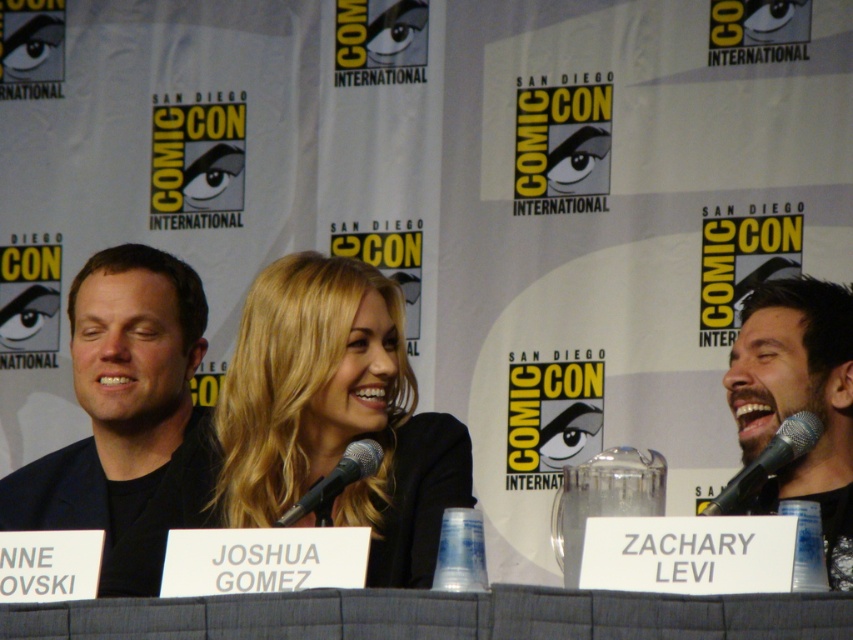
Can you confirm if black matte suit at left is positioned to the left of black metallic microphone at center?

Yes, black matte suit at left is to the left of black metallic microphone at center.

Between point (79, 508) and point (347, 445), which one is positioned in front?

Point (347, 445)

Describe the element at coordinates (128, 419) in the screenshot. I see `black matte suit at left` at that location.

Identify the location of black matte suit at left. This screenshot has width=853, height=640. (128, 419).

Based on the photo, can you confirm if blonde hair at center is shorter than black matte suit at left?

Indeed, blonde hair at center has a lesser height compared to black matte suit at left.

Between blonde hair at center and black matte suit at left, which one is positioned higher?

Positioned higher is blonde hair at center.

You are a GUI agent. You are given a task and a screenshot of the screen. Output one action in this format:
    pyautogui.click(x=<x>, y=<y>)
    Task: Click on the blonde hair at center
    Image resolution: width=853 pixels, height=640 pixels.
    Given the screenshot: What is the action you would take?
    pyautogui.click(x=335, y=413)

The width and height of the screenshot is (853, 640). In order to click on blonde hair at center in this screenshot , I will do `click(335, 413)`.

Measure the distance between black matte beard at right and camera.

black matte beard at right and camera are 19.30 meters apart from each other.

Is point (772, 381) closer to camera compared to point (357, 461)?

That is False.

Where is `black matte beard at right`? The image size is (853, 640). black matte beard at right is located at coordinates (799, 401).